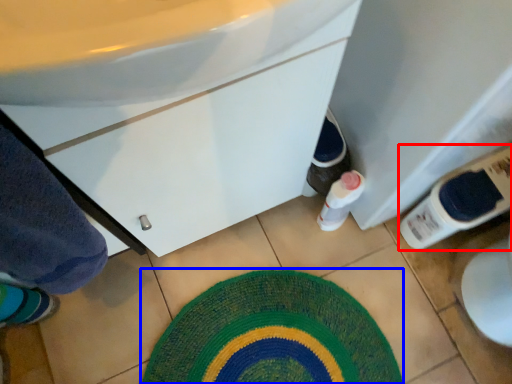
Question: Among these objects, which one is nearest to the camera, bottle (highlighted by a red box) or bath mat (highlighted by a blue box)?

Choices:
 (A) bottle
 (B) bath mat

Answer: (A)